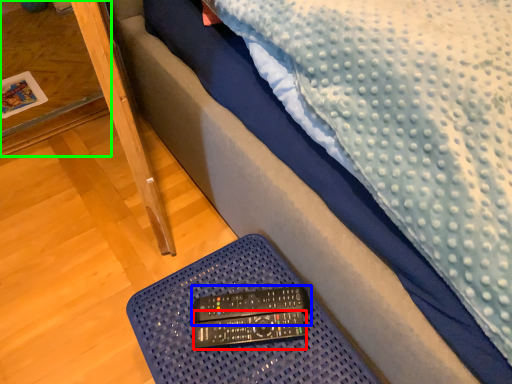
Question: Which object is positioned farthest from control (highlighted by a red box)? Select from control (highlighted by a blue box) and table (highlighted by a green box).

Choices:
 (A) control
 (B) table

Answer: (B)